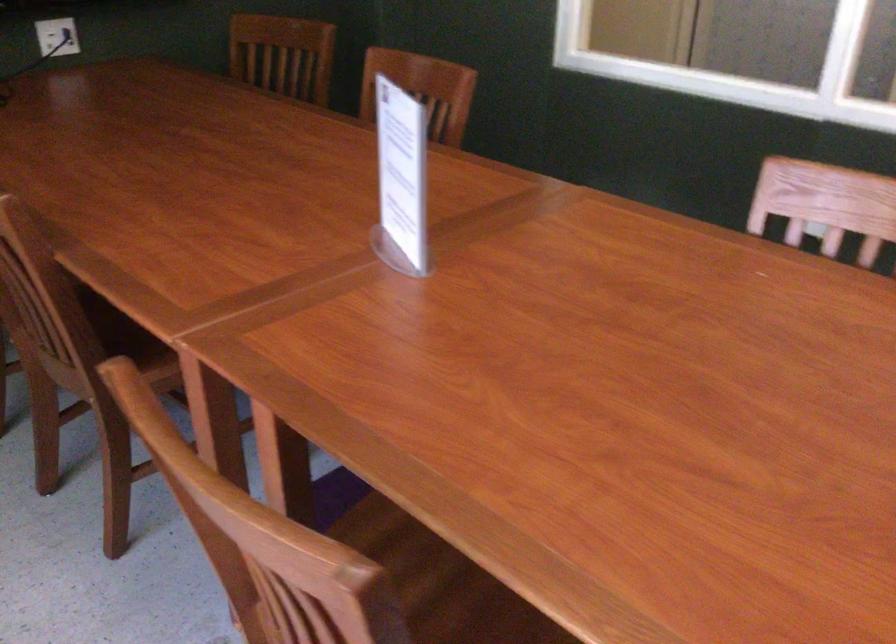
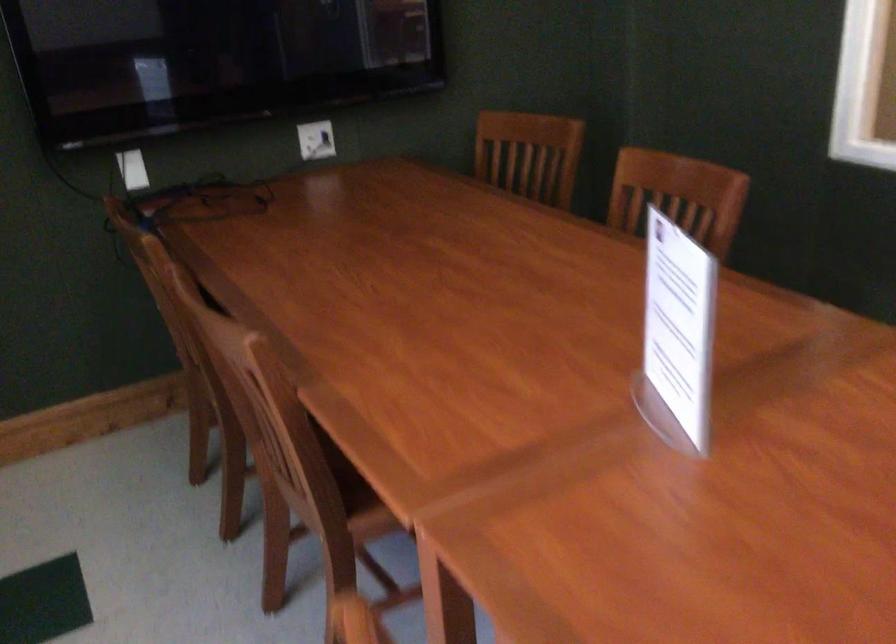
The point at (403, 183) is marked in the first image. Where is the corresponding point in the second image?

(677, 335)